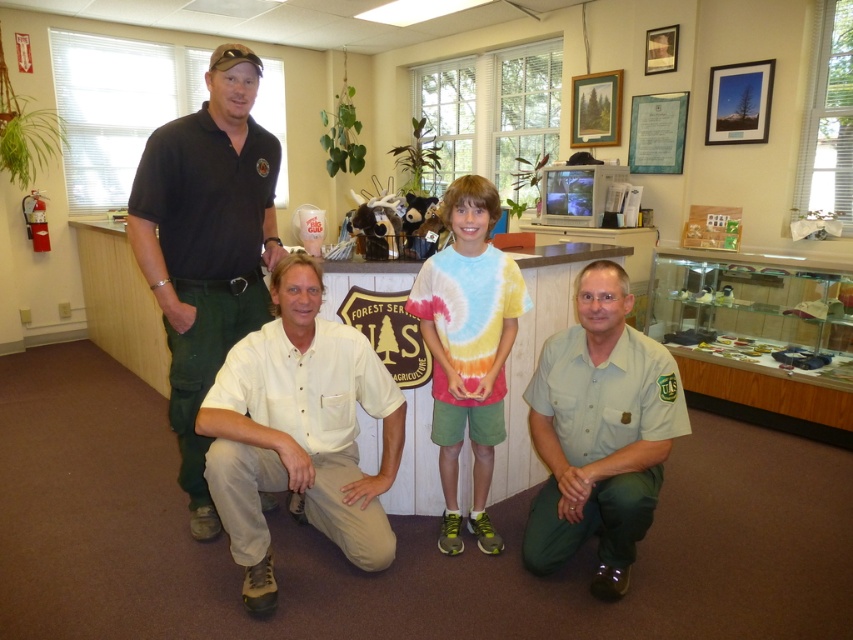
Question: Among these objects, which one is nearest to the camera?

Choices:
 (A) black uniform at upper left
 (B) light green uniform at lower right
 (C) beige cotton shirt at center

Answer: (C)

Question: Based on their relative distances, which object is nearer to the tie-dye fabric shirt at center?

Choices:
 (A) white cotton shirt at center
 (B) beige cotton shirt at center
 (C) black uniform at upper left

Answer: (A)

Question: Which of the following is the farthest from the observer?

Choices:
 (A) [x=242, y=168]
 (B) [x=302, y=369]
 (C) [x=474, y=522]

Answer: (C)

Question: Can you confirm if white cotton shirt at center is positioned below beige cotton shirt at center?

Choices:
 (A) no
 (B) yes

Answer: (A)

Question: Considering the relative positions of beige cotton shirt at center and tie-dye fabric shirt at center in the image provided, where is beige cotton shirt at center located with respect to tie-dye fabric shirt at center?

Choices:
 (A) left
 (B) right

Answer: (A)

Question: Does beige cotton shirt at center have a lesser width compared to black uniform at upper left?

Choices:
 (A) yes
 (B) no

Answer: (B)